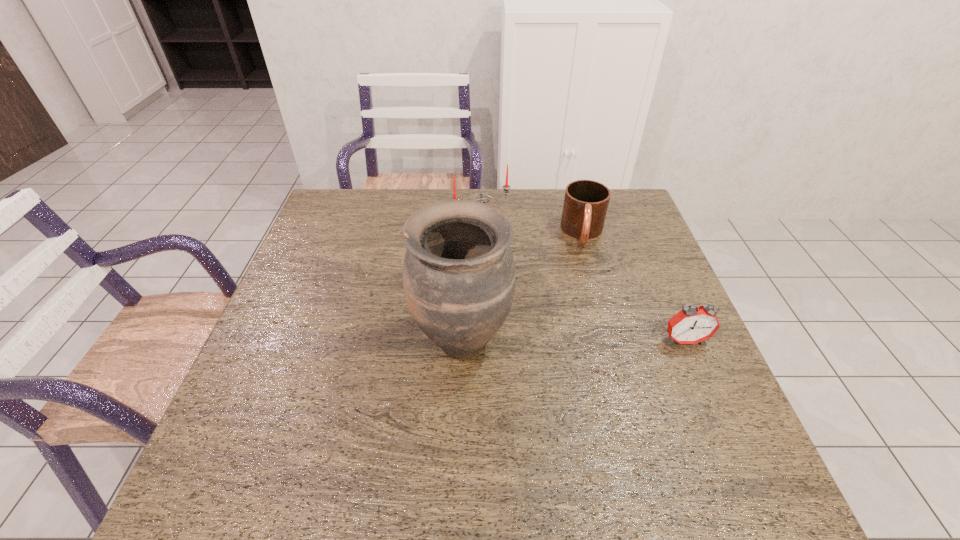
Locate an element on the screen. The height and width of the screenshot is (540, 960). vacant space that is in between the mug and the alarm clock is located at coordinates (634, 287).

Find the location of a particular element. unoccupied position between the third shortest object and the rightmost object is located at coordinates (583, 283).

At what (x,y) coordinates should I click in order to perform the action: click on vacant space that is in between the second object from right to left and the second tallest object. Please return your answer as a coordinate pair (x, y). The width and height of the screenshot is (960, 540). Looking at the image, I should click on (532, 230).

In order to click on the second closest object to the third object from left to right in this screenshot , I will do (459, 275).

Locate which object ranks second in proximity to the candle. Please provide its 2D coordinates. Your answer should be formatted as a tuple, i.e. [(x, y)], where the tuple contains the x and y coordinates of a point satisfying the conditions above.

[(459, 275)]

Locate an element on the screen. free space that satisfies the following two spatial constraints: 1. on the back side of the mug; 2. on the left side of the urn is located at coordinates (467, 233).

Where is `vacant space that satisfies the following two spatial constraints: 1. on the back side of the urn; 2. on the left side of the third shortest object`? Image resolution: width=960 pixels, height=540 pixels. vacant space that satisfies the following two spatial constraints: 1. on the back side of the urn; 2. on the left side of the third shortest object is located at coordinates (467, 225).

This screenshot has height=540, width=960. In order to click on vacant region that satisfies the following two spatial constraints: 1. on the front side of the mug; 2. on the right side of the second tallest object in this screenshot , I will do `click(481, 233)`.

The width and height of the screenshot is (960, 540). I want to click on vacant region that satisfies the following two spatial constraints: 1. on the back side of the candle; 2. on the right side of the urn, so click(467, 225).